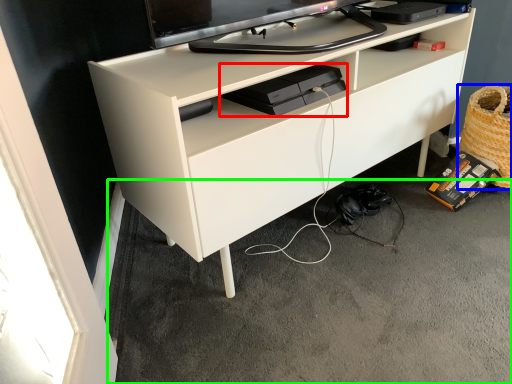
Question: Based on their relative distances, which object is farther from equipment (highlighted by a red box)? Choose from basket (highlighted by a blue box) and concrete (highlighted by a green box).

Choices:
 (A) basket
 (B) concrete

Answer: (A)